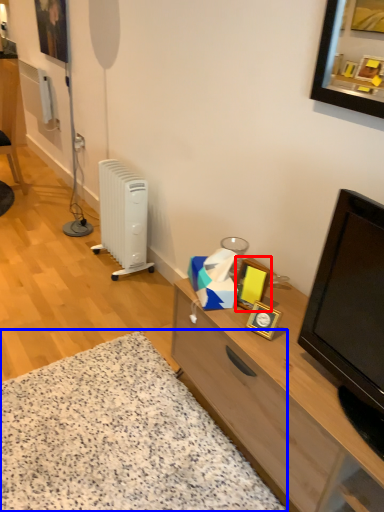
Question: Which of the following is the closest to the observer, picture frame (highlighted by a red box) or plain (highlighted by a blue box)?

Choices:
 (A) picture frame
 (B) plain

Answer: (B)